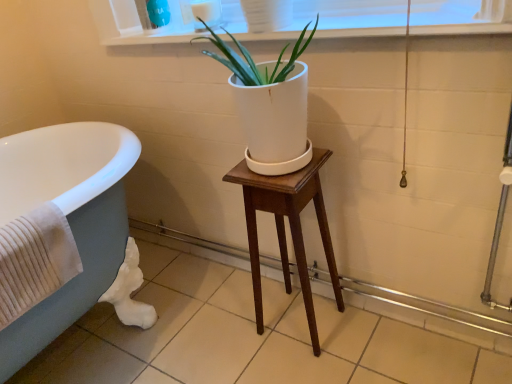
Question: Would you consider matte gray tub at left to be distant from white glossy window sill at upper center?

Choices:
 (A) no
 (B) yes

Answer: (A)

Question: Is matte gray tub at left facing towards white glossy window sill at upper center?

Choices:
 (A) yes
 (B) no

Answer: (B)

Question: Is matte gray tub at left next to white glossy window sill at upper center and touching it?

Choices:
 (A) no
 (B) yes

Answer: (A)

Question: Considering the relative sizes of matte gray tub at left and white glossy window sill at upper center in the image provided, is matte gray tub at left thinner than white glossy window sill at upper center?

Choices:
 (A) no
 (B) yes

Answer: (A)

Question: Does matte gray tub at left have a lesser height compared to white glossy window sill at upper center?

Choices:
 (A) yes
 (B) no

Answer: (B)

Question: In the image, is white matte pot at center positioned in front of or behind matte gray tub at left?

Choices:
 (A) front
 (B) behind

Answer: (A)

Question: In terms of width, does white matte pot at center look wider or thinner when compared to matte gray tub at left?

Choices:
 (A) thin
 (B) wide

Answer: (A)

Question: From a real-world perspective, is white matte pot at center physically located above or below matte gray tub at left?

Choices:
 (A) below
 (B) above

Answer: (B)

Question: Looking at the image, does white matte pot at center seem bigger or smaller compared to matte gray tub at left?

Choices:
 (A) small
 (B) big

Answer: (A)

Question: Is point (245, 168) closer or farther from the camera than point (95, 210)?

Choices:
 (A) closer
 (B) farther

Answer: (A)

Question: Is mahogany wood stool at center taller or shorter than matte gray tub at left?

Choices:
 (A) short
 (B) tall

Answer: (A)

Question: In the image, is mahogany wood stool at center on the left side or the right side of matte gray tub at left?

Choices:
 (A) right
 (B) left

Answer: (A)

Question: From the image's perspective, is mahogany wood stool at center located above or below matte gray tub at left?

Choices:
 (A) above
 (B) below

Answer: (A)

Question: Would you say matte gray tub at left is to the left or to the right of mahogany wood stool at center in the picture?

Choices:
 (A) right
 (B) left

Answer: (B)

Question: From the image's perspective, is matte gray tub at left located above or below mahogany wood stool at center?

Choices:
 (A) below
 (B) above

Answer: (A)